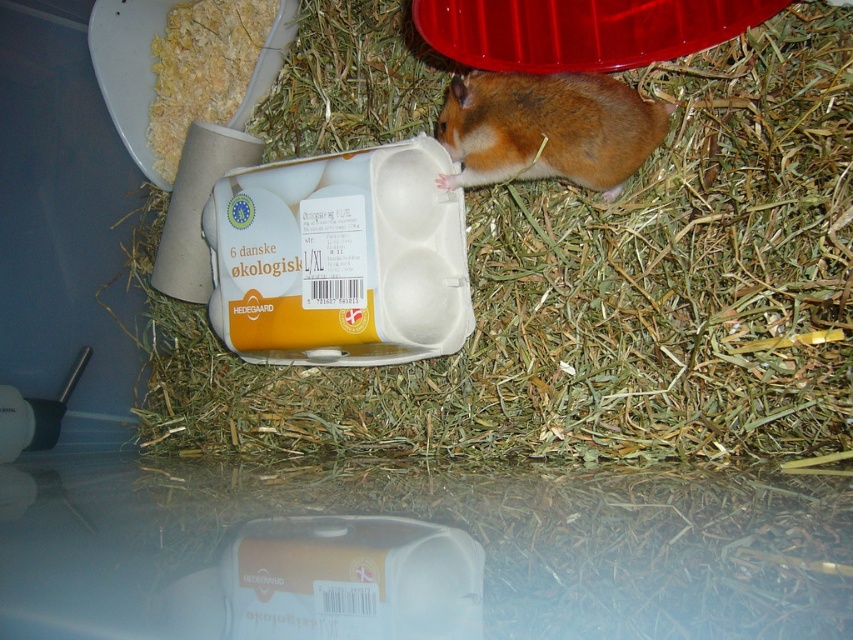
Question: Can you confirm if green straw at center is thinner than brown furry hamster at upper right?

Choices:
 (A) yes
 (B) no

Answer: (B)

Question: Which of the following is the farthest from the observer?

Choices:
 (A) green straw at center
 (B) brown furry hamster at upper right

Answer: (B)

Question: Can you confirm if green straw at center is positioned below brown furry hamster at upper right?

Choices:
 (A) yes
 (B) no

Answer: (A)

Question: Does green straw at center have a lesser width compared to brown furry hamster at upper right?

Choices:
 (A) yes
 (B) no

Answer: (B)